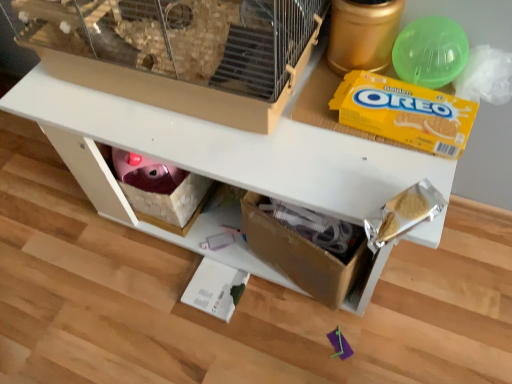
Locate an element on the screen. The height and width of the screenshot is (384, 512). vacant space situated above white matte table at center (from a real-world perspective) is located at coordinates (271, 124).